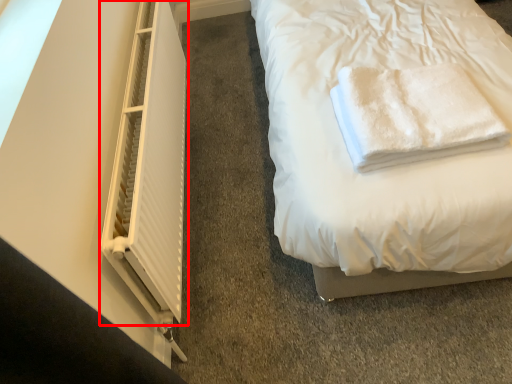
Question: In this image, where is window (annotated by the red box) located relative to towel?

Choices:
 (A) left
 (B) right

Answer: (A)